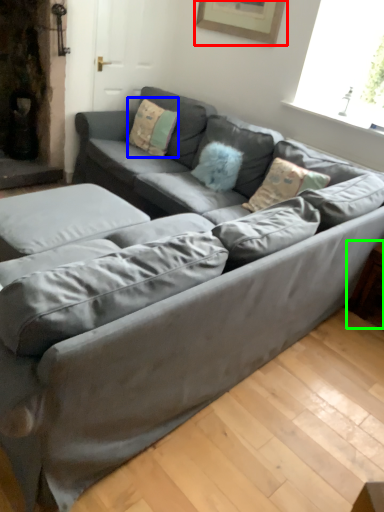
Question: Which is nearer to the picture frame (highlighted by a red box)? pillow (highlighted by a blue box) or side table (highlighted by a green box).

Choices:
 (A) pillow
 (B) side table

Answer: (A)